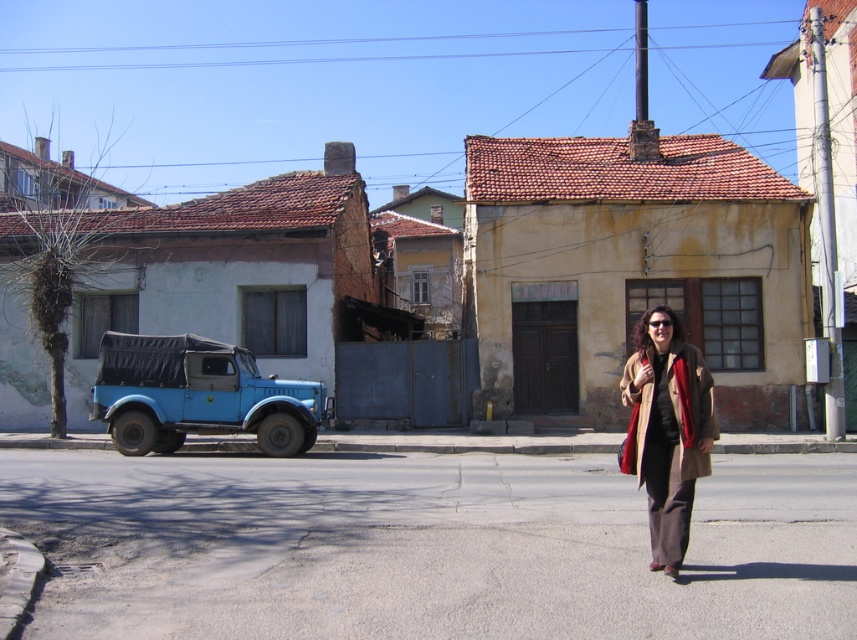
Who is positioned more to the left, blue matte jeep at left or beige wool coat at center?

Positioned to the left is blue matte jeep at left.

Which is in front, point (201, 396) or point (658, 442)?

Point (658, 442)

The width and height of the screenshot is (857, 640). Find the location of `blue matte jeep at left`. blue matte jeep at left is located at coordinates (196, 396).